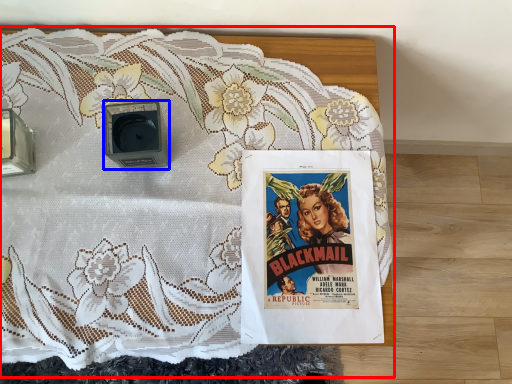
Question: Which object is closer to the camera taking this photo, bed (highlighted by a red box) or alarm (highlighted by a blue box)?

Choices:
 (A) bed
 (B) alarm

Answer: (A)